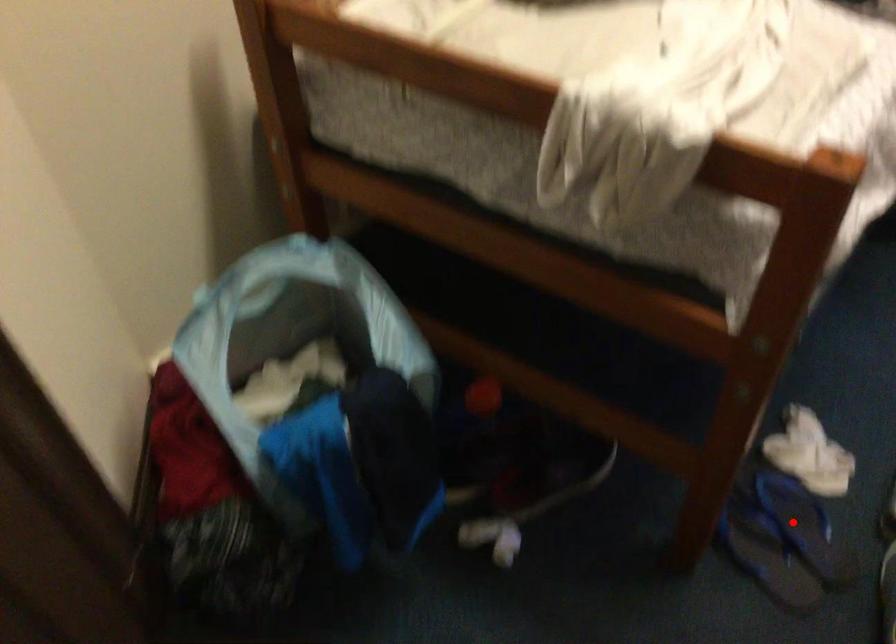
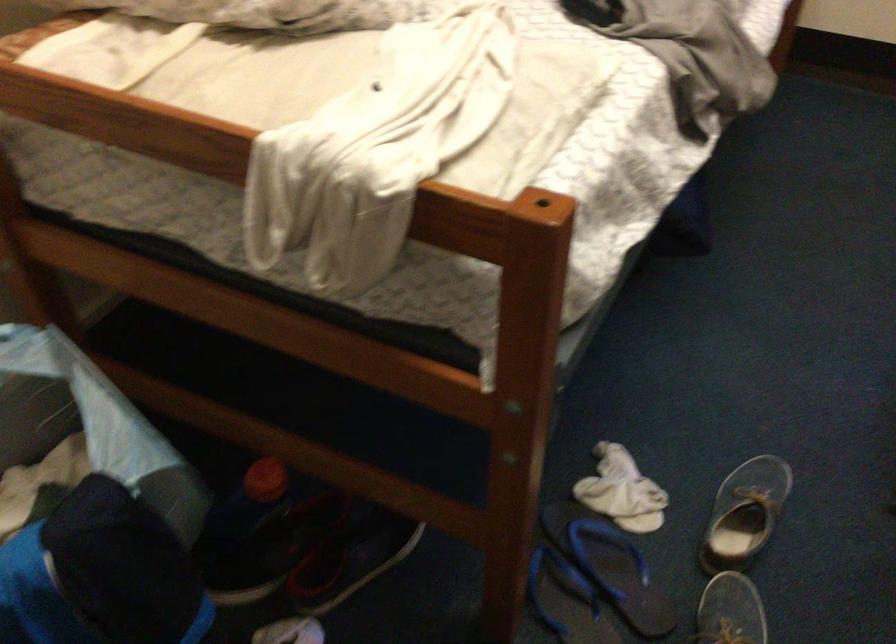
Find the pixel in the second image that matches the highlighted location in the first image.

(609, 565)